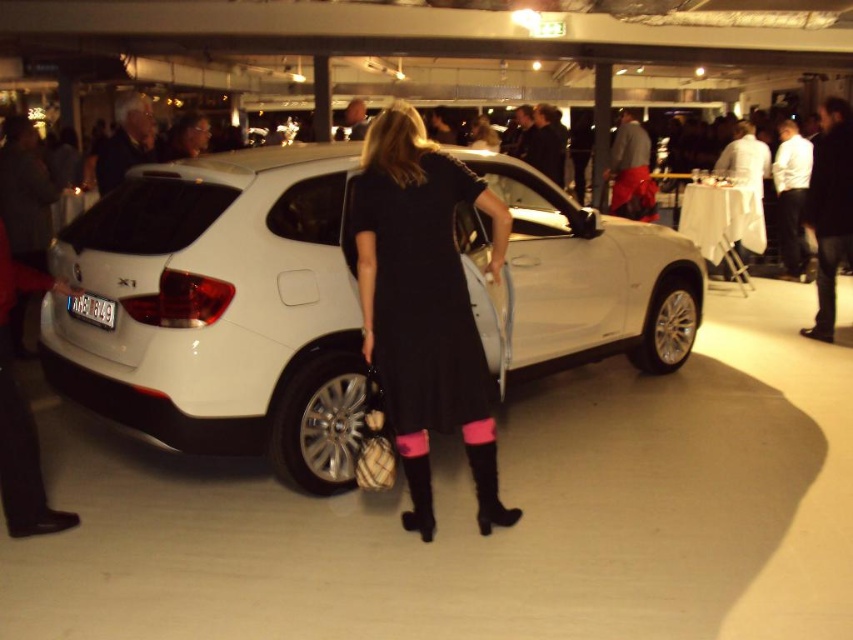
Does white metallic car at center have a greater height compared to black matte dress at center?

Yes, white metallic car at center is taller than black matte dress at center.

Can you confirm if white metallic car at center is bigger than black matte dress at center?

Indeed, white metallic car at center has a larger size compared to black matte dress at center.

Locate an element on the screen. This screenshot has height=640, width=853. white metallic car at center is located at coordinates (219, 308).

What are the coordinates of `white metallic car at center` in the screenshot? It's located at (219, 308).